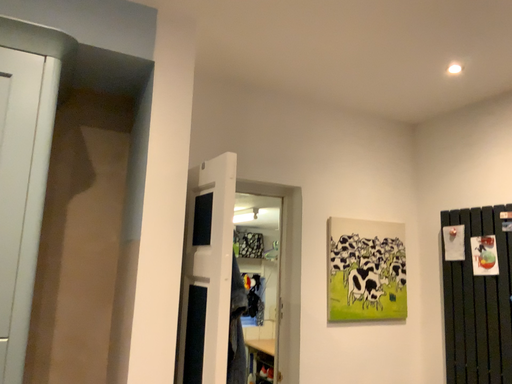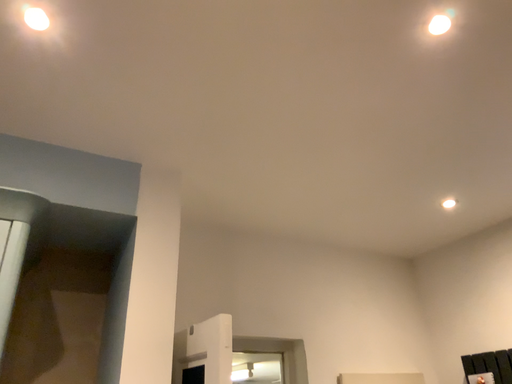
Question: How did the camera likely rotate when shooting the video?

Choices:
 (A) rotated downward
 (B) rotated upward

Answer: (B)